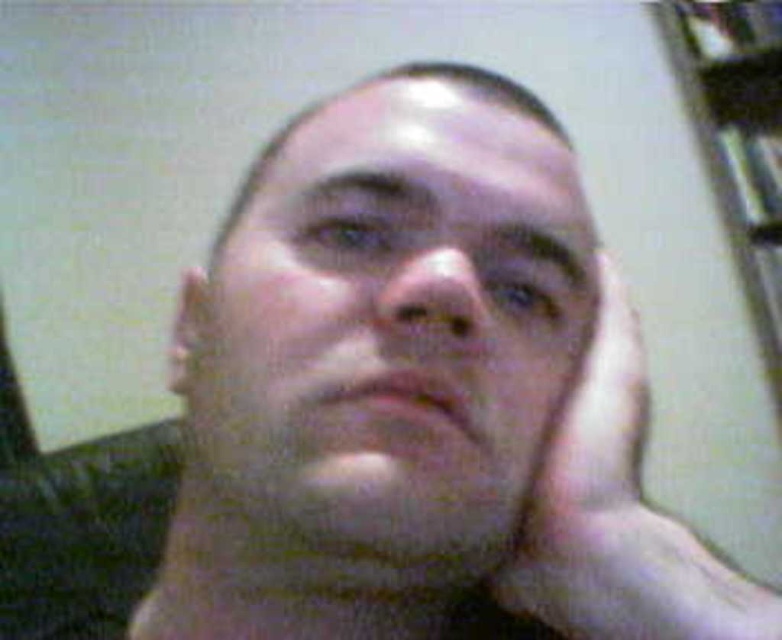
Is smooth skin face at center to the left of white matte hand at center from the viewer's perspective?

Correct, you'll find smooth skin face at center to the left of white matte hand at center.

Is point (418, 440) positioned before point (592, 595)?

Yes.

You are a GUI agent. You are given a task and a screenshot of the screen. Output one action in this format:
    pyautogui.click(x=<x>, y=<y>)
    Task: Click on the smooth skin face at center
    This screenshot has height=640, width=782.
    Given the screenshot: What is the action you would take?
    409,304

At what (x,y) coordinates should I click in order to perform the action: click on smooth skin face at center. Please return your answer as a coordinate pair (x, y). Looking at the image, I should click on (409, 304).